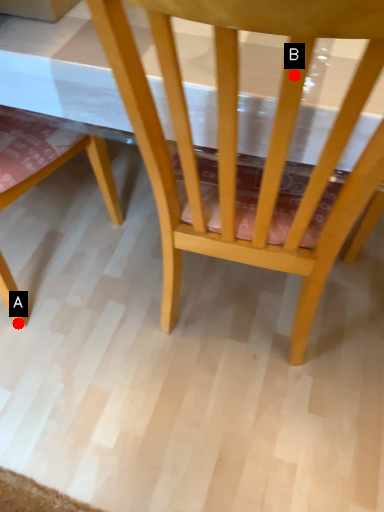
Question: Two points are circled on the image, labeled by A and B beside each circle. Which of the following is the closest to the observer?

Choices:
 (A) A is closer
 (B) B is closer

Answer: (B)